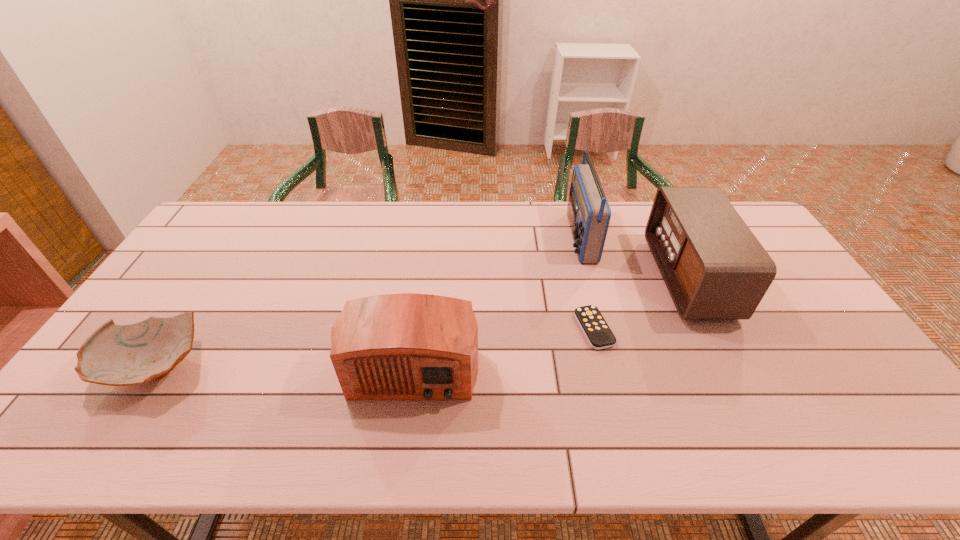
Locate which object is the closest to the shortest object. Please provide its 2D coordinates. Your answer should be formatted as a tuple, i.e. [(x, y)], where the tuple contains the x and y coordinates of a point satisfying the conditions above.

[(588, 211)]

Point out which object is positioned as the fourth nearest to the leftmost object. Please provide its 2D coordinates. Your answer should be formatted as a tuple, i.e. [(x, y)], where the tuple contains the x and y coordinates of a point satisfying the conditions above.

[(714, 268)]

Identify the location of radio receiver that stands as the closest to the pottery. [407, 346].

Locate which radio receiver ranks second in proximity to the second radio receiver from left to right. Please provide its 2D coordinates. Your answer should be formatted as a tuple, i.e. [(x, y)], where the tuple contains the x and y coordinates of a point satisfying the conditions above.

[(407, 346)]

This screenshot has width=960, height=540. Find the location of `vacant point that satisfies the following two spatial constraints: 1. on the front-facing side of the rightmost radio receiver; 2. on the front-facing side of the leftmost radio receiver`. vacant point that satisfies the following two spatial constraints: 1. on the front-facing side of the rightmost radio receiver; 2. on the front-facing side of the leftmost radio receiver is located at coordinates 731,362.

Locate an element on the screen. free space that satisfies the following two spatial constraints: 1. on the front panel of the second radio receiver from right to left; 2. on the front side of the shortest object is located at coordinates (605, 329).